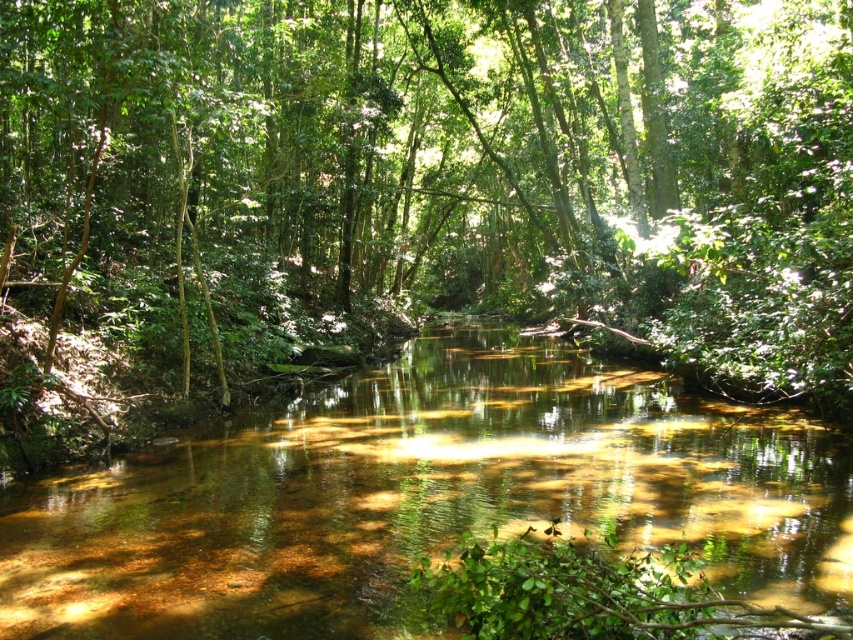
You are standing in the forest and want to take a photo of the green leafy tree at center. If your camera can focus on objects up to 30 feet away, will it be able to capture the tree clearly?

The green leafy tree at center is 30.40 feet from viewer, which is slightly beyond the camera focus range of 30 feet. Therefore, the camera may not be able to capture the tree clearly.

You are standing in the forest and want to take a photo of the green leafy tree at center. If you move 0.1 units to the right along the x axis, will the tree still be in the center of your camera view?

The green leafy tree at center is located at point (456, 163). Moving 0.1 units to the right along the x axis would shift your position, but the tree remains at its original coordinates. Therefore, the tree will no longer be centered in your view since your position has changed relative to it.